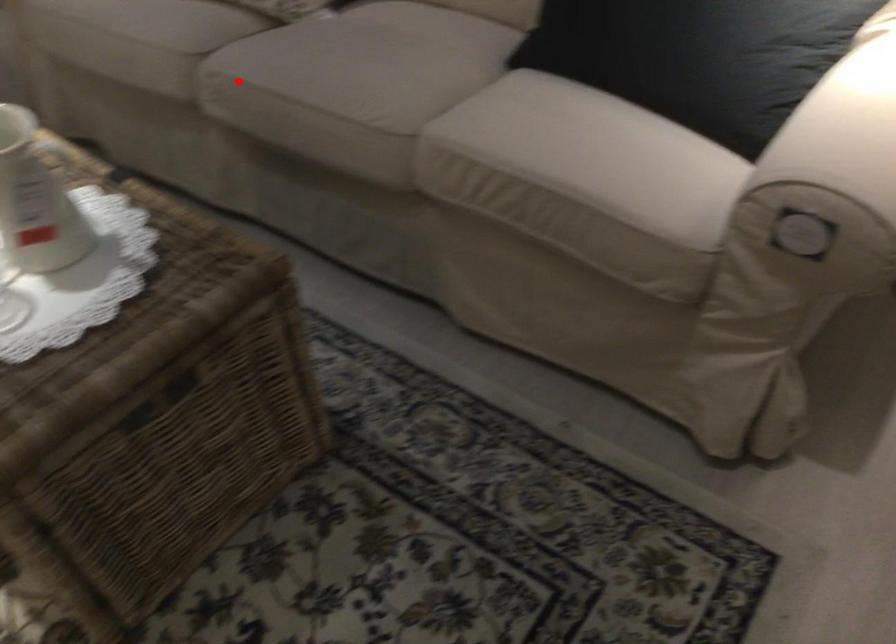
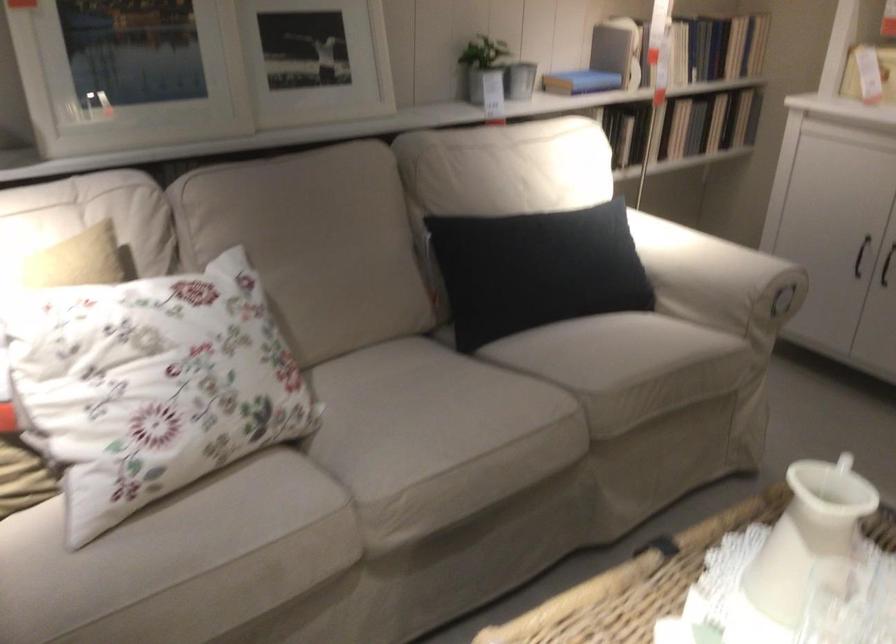
Question: I am providing you with two images of the same scene from different viewpoints. A red point is shown in image1. For the corresponding object point in image2, is it positioned nearer or farther from the camera?

Choices:
 (A) Nearer
 (B) Farther

Answer: (A)